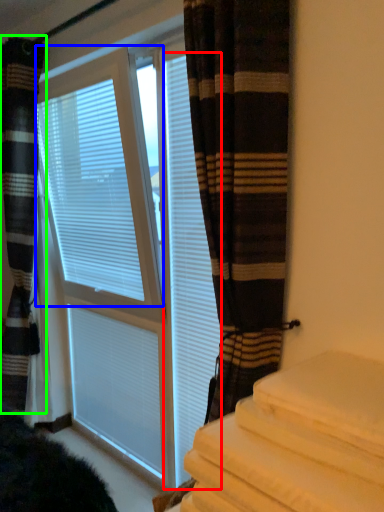
Question: Which is nearer to the shutter (highlighted by a red box)? window blind (highlighted by a blue box) or curtain (highlighted by a green box).

Choices:
 (A) window blind
 (B) curtain

Answer: (A)